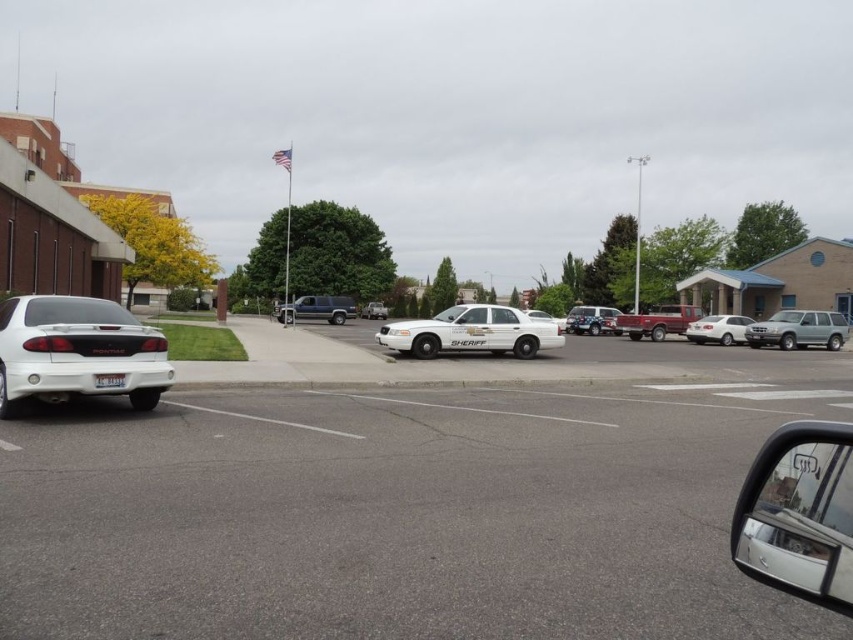
Between white glossy sedan at center-right and white matte sheriff car at center, which one appears on the right side from the viewer's perspective?

From the viewer's perspective, white glossy sedan at center-right appears more on the right side.

Is white glossy sedan at center-right below white matte sheriff car at center?

Indeed, white glossy sedan at center-right is positioned under white matte sheriff car at center.

The image size is (853, 640). What do you see at coordinates (718, 328) in the screenshot? I see `white glossy sedan at center-right` at bounding box center [718, 328].

At what (x,y) coordinates should I click in order to perform the action: click on white glossy sedan at center-right. Please return your answer as a coordinate pair (x, y). Looking at the image, I should click on (718, 328).

Where is `white glossy sedan at center-right`? Image resolution: width=853 pixels, height=640 pixels. white glossy sedan at center-right is located at coordinates (718, 328).

Is white glossy sedan at center-right to the right of white plastic license plate at lower left from the viewer's perspective?

Yes, white glossy sedan at center-right is to the right of white plastic license plate at lower left.

Identify the location of white glossy sedan at center-right. (718, 328).

Is white glossy sedan at center closer to the viewer compared to silver metallic suv at right?

Yes, white glossy sedan at center is in front of silver metallic suv at right.

Identify the location of white glossy sedan at center. The image size is (853, 640). (407, 508).

The width and height of the screenshot is (853, 640). What are the coordinates of `white glossy sedan at center` in the screenshot? It's located at (407, 508).